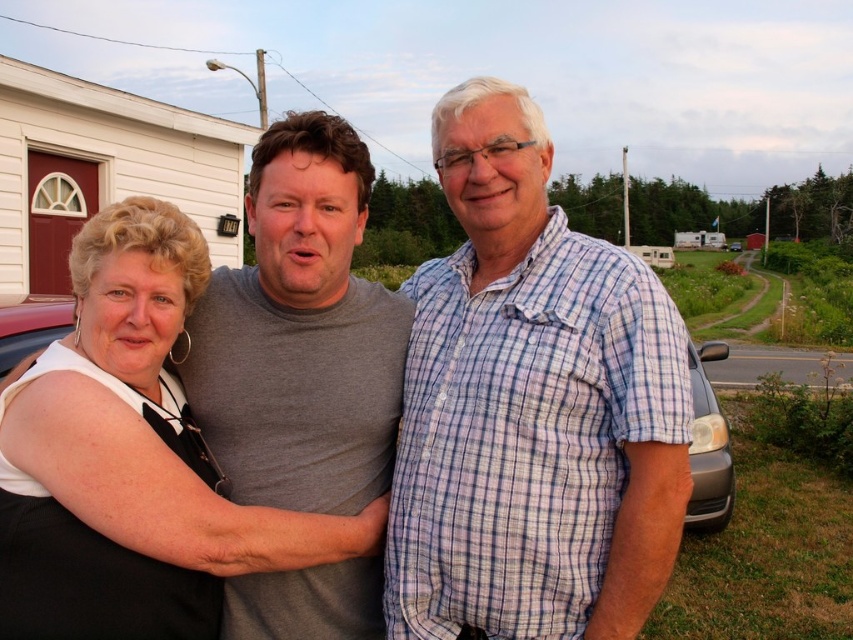
Question: Is plaid cotton shirt at center to the left of matte black dress at center from the viewer's perspective?

Choices:
 (A) no
 (B) yes

Answer: (A)

Question: Estimate the real-world distances between objects in this image. Which object is farther from the matte gray shirt at center?

Choices:
 (A) matte black dress at center
 (B) plaid cotton shirt at center

Answer: (A)

Question: Among these objects, which one is farthest from the camera?

Choices:
 (A) plaid cotton shirt at center
 (B) matte black dress at center

Answer: (A)

Question: Which of the following is the closest to the observer?

Choices:
 (A) (433, 564)
 (B) (680, 449)

Answer: (B)

Question: Is matte gray shirt at center to the right of matte black dress at center from the viewer's perspective?

Choices:
 (A) yes
 (B) no

Answer: (A)

Question: Does matte gray shirt at center appear on the right side of matte black dress at center?

Choices:
 (A) no
 (B) yes

Answer: (B)